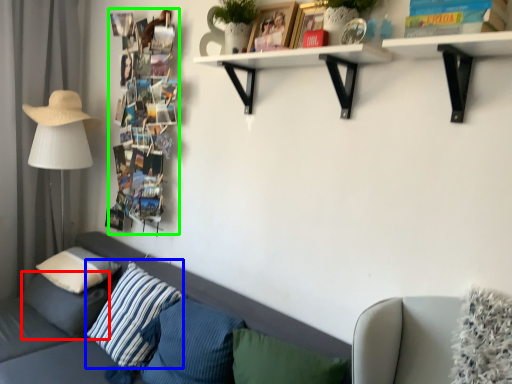
Question: Which object is positioned farthest from pillow (highlighted by a red box)? Select from pillow (highlighted by a blue box) and book (highlighted by a green box).

Choices:
 (A) pillow
 (B) book

Answer: (B)